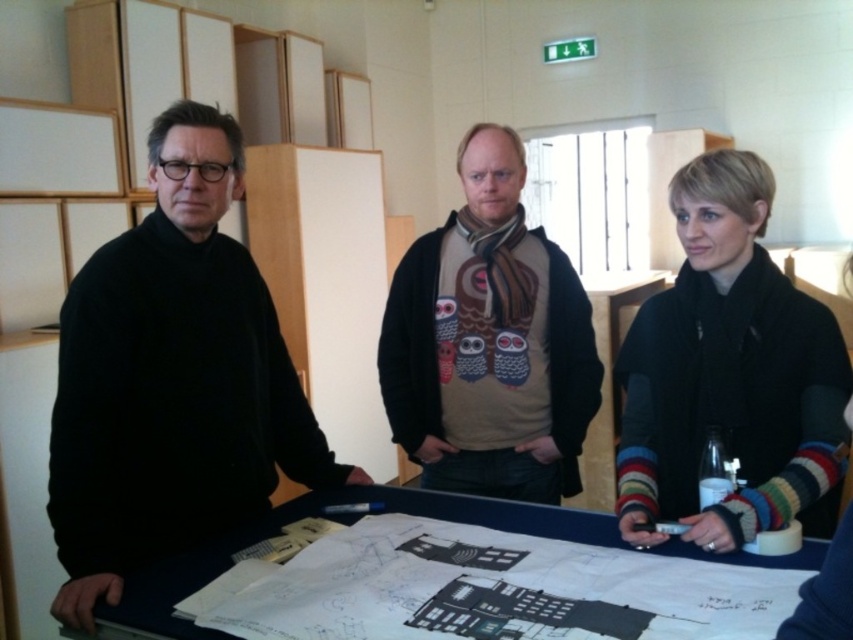
Question: Where is black woolen scarf at center located in relation to blue fabric table at center in the image?

Choices:
 (A) left
 (B) right

Answer: (B)

Question: Does black woolen scarf at center appear under olive green sweater at center?

Choices:
 (A) no
 (B) yes

Answer: (B)

Question: Among these objects, which one is nearest to the camera?

Choices:
 (A) olive green sweater at center
 (B) blue fabric table at center
 (C) black woolen scarf at center
 (D) black matte sweater at left

Answer: (B)

Question: Can you confirm if black woolen scarf at center is positioned below olive green sweater at center?

Choices:
 (A) no
 (B) yes

Answer: (B)

Question: Which of the following is the farthest from the observer?

Choices:
 (A) olive green sweater at center
 (B) black woolen scarf at center
 (C) blue fabric table at center
 (D) black matte sweater at left

Answer: (A)

Question: Estimate the real-world distances between objects in this image. Which object is closer to the blue fabric table at center?

Choices:
 (A) black matte sweater at left
 (B) olive green sweater at center
 (C) black woolen scarf at center

Answer: (A)